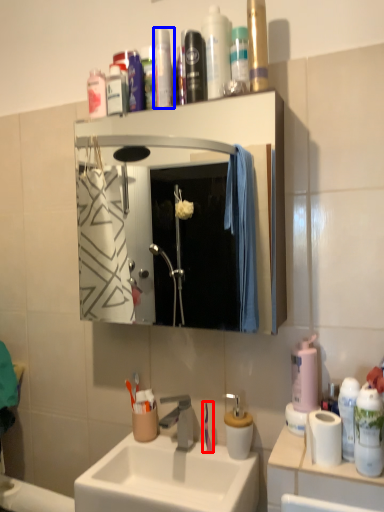
Question: Which object appears farthest to the camera in this image, toothbrush (highlighted by a red box) or toiletry (highlighted by a blue box)?

Choices:
 (A) toothbrush
 (B) toiletry

Answer: (A)